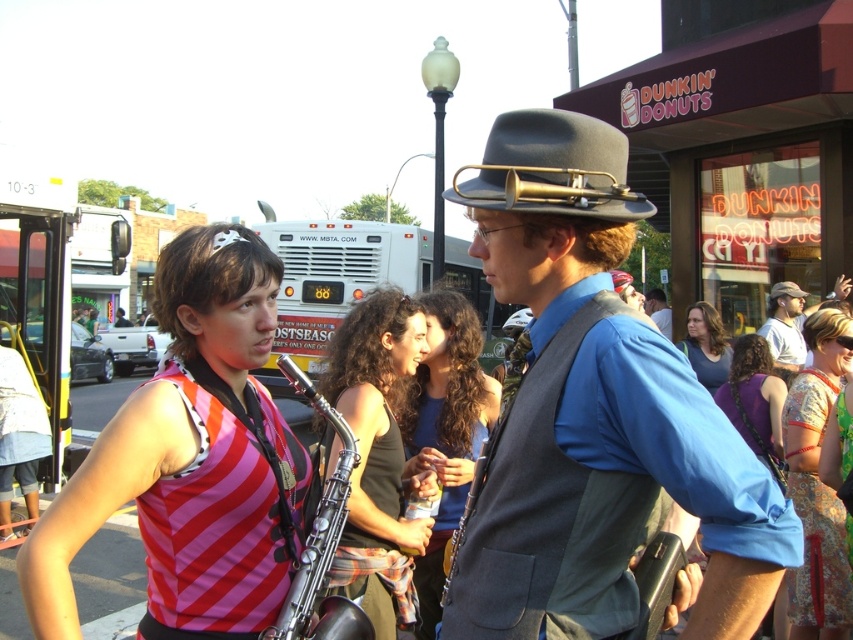
Between printed fabric dress at center and matte blue shirt at center, which one is positioned lower?

printed fabric dress at center is lower down.

In the scene shown: Who is more forward, (787, 586) or (665, 336)?

Positioned in front is point (787, 586).

You are a GUI agent. You are given a task and a screenshot of the screen. Output one action in this format:
    pyautogui.click(x=<x>, y=<y>)
    Task: Click on the printed fabric dress at center
    
    Given the screenshot: What is the action you would take?
    pyautogui.click(x=817, y=486)

Is point (296, 531) farther from camera compared to point (424, 272)?

No, (296, 531) is closer to viewer.

Who is positioned more to the left, striped fabric tank top at center or white matte bus at center?

Positioned to the left is striped fabric tank top at center.

Is point (102, 467) positioned in front of point (358, 252)?

That is True.

This screenshot has width=853, height=640. Identify the location of striped fabric tank top at center. (190, 460).

Does matte green shirt at center appear on the right side of white plastic bus at left?

Correct, you'll find matte green shirt at center to the right of white plastic bus at left.

Is point (428, 336) more distant than point (67, 307)?

No.

Is point (474, 342) positioned behind point (47, 227)?

That is False.

The height and width of the screenshot is (640, 853). In order to click on matte green shirt at center in this screenshot , I will do `click(445, 429)`.